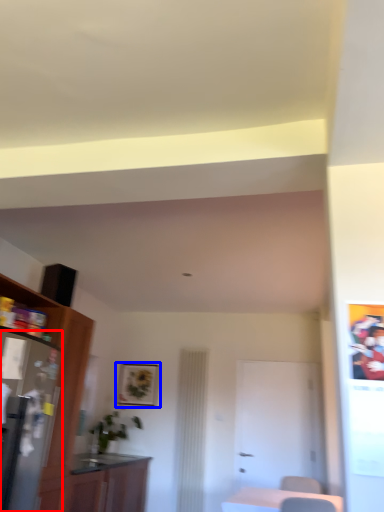
Question: Which object is closer to the camera taking this photo, appliance (highlighted by a red box) or picture frame (highlighted by a blue box)?

Choices:
 (A) appliance
 (B) picture frame

Answer: (A)